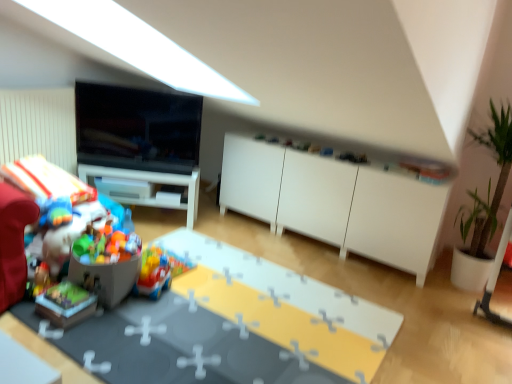
Measure the distance between white glossy desk at center and camera.

3.30 meters.

What are the coordinates of `translucent plastic toy car at center, which is the 1th toy from right to left` in the screenshot? It's located at (153, 273).

Find the location of a particular element. Image resolution: width=512 pixels, height=384 pixels. wooden block at lower left, arranged as the 2th toy when viewed from the left is located at coordinates (65, 304).

The height and width of the screenshot is (384, 512). What do you see at coordinates (65, 304) in the screenshot?
I see `wooden block at lower left, the 3th toy positioned from the right` at bounding box center [65, 304].

Locate an element on the screen. The width and height of the screenshot is (512, 384). matte plastic table at lower left is located at coordinates (286, 306).

What do you see at coordinates (335, 202) in the screenshot? The width and height of the screenshot is (512, 384). I see `white matte cabinet at center` at bounding box center [335, 202].

Where is `white matte cabinet at center`? Image resolution: width=512 pixels, height=384 pixels. white matte cabinet at center is located at coordinates (335, 202).

What do you see at coordinates (106, 275) in the screenshot?
I see `plastic colorful toys at lower left, marked as the second toy in a right-to-left arrangement` at bounding box center [106, 275].

You are a GUI agent. You are given a task and a screenshot of the screen. Output one action in this format:
    pyautogui.click(x=<x>, y=<y>)
    Task: Click on the white glossy desk at center
    The width and height of the screenshot is (512, 384).
    Given the screenshot: What is the action you would take?
    pyautogui.click(x=152, y=182)

Considering the positions of point (80, 187) and point (51, 295), is point (80, 187) closer or farther from the camera than point (51, 295)?

Point (80, 187).

Does multicolored plastic toys at left, which is the 4th toy from right to left, have a larger size compared to wooden block at lower left, the 3th toy positioned from the right?

Yes.

From the image's perspective, which is above, multicolored plastic toys at left, which is the 4th toy from right to left, or wooden block at lower left, arranged as the 2th toy when viewed from the left?

From the image's view, multicolored plastic toys at left, which is the 4th toy from right to left, is above.

Starting from the multicolored plastic toys at left, the 1th toy from the left, which toy is the 2nd one in front? Please provide its 2D coordinates.

[(65, 304)]

Between wooden block at lower left, the 3th toy positioned from the right, and multicolored plastic toys at left, which is the 4th toy from right to left, which one has less height?

Standing shorter between the two is wooden block at lower left, the 3th toy positioned from the right.

Is wooden block at lower left, the 3th toy positioned from the right, positioned far away from multicolored plastic toys at left, which is the 4th toy from right to left?

Actually, wooden block at lower left, the 3th toy positioned from the right, and multicolored plastic toys at left, which is the 4th toy from right to left, are a little close together.

Is wooden block at lower left, the 3th toy positioned from the right, not inside multicolored plastic toys at left, the 1th toy from the left?

Yes, wooden block at lower left, the 3th toy positioned from the right, is located beyond the bounds of multicolored plastic toys at left, the 1th toy from the left.

How many degrees apart are the facing directions of wooden block at lower left, arranged as the 2th toy when viewed from the left, and green leafy plant in pot at right?

The facing directions of wooden block at lower left, arranged as the 2th toy when viewed from the left, and green leafy plant in pot at right are 89.9 degrees apart.

Is wooden block at lower left, the 3th toy positioned from the right, bigger than green leafy plant in pot at right?

Incorrect, wooden block at lower left, the 3th toy positioned from the right, is not larger than green leafy plant in pot at right.

From the image's perspective, would you say wooden block at lower left, the 3th toy positioned from the right, is shown under green leafy plant in pot at right?

Correct, wooden block at lower left, the 3th toy positioned from the right, appears lower than green leafy plant in pot at right in the image.

Identify the location of toy that is the 2nd one when counting forward from the green leafy plant in pot at right. (65, 304).

Which of these two, multicolored plastic toys at left, the 1th toy from the left, or matte black tv at upper left, is thinner?

matte black tv at upper left.

Identify the location of television on the right of multicolored plastic toys at left, which is the 4th toy from right to left. The height and width of the screenshot is (384, 512). (137, 128).

Is multicolored plastic toys at left, which is the 4th toy from right to left, aimed at matte black tv at upper left?

No, multicolored plastic toys at left, which is the 4th toy from right to left, is not oriented towards matte black tv at upper left.

The height and width of the screenshot is (384, 512). I want to click on desk located behind the plastic colorful toys at lower left, marked as the second toy in a right-to-left arrangement, so click(x=152, y=182).

From the image's perspective, is plastic colorful toys at lower left, marked as the third toy in a left-to-right arrangement, above or below white glossy desk at center?

plastic colorful toys at lower left, marked as the third toy in a left-to-right arrangement, is below white glossy desk at center.

How many degrees apart are the facing directions of plastic colorful toys at lower left, marked as the third toy in a left-to-right arrangement, and wooden block at lower left, the 3th toy positioned from the right?

The facing directions of plastic colorful toys at lower left, marked as the third toy in a left-to-right arrangement, and wooden block at lower left, the 3th toy positioned from the right, are 19.9 degrees apart.

Considering the relative positions of plastic colorful toys at lower left, marked as the third toy in a left-to-right arrangement, and wooden block at lower left, arranged as the 2th toy when viewed from the left, in the image provided, is plastic colorful toys at lower left, marked as the third toy in a left-to-right arrangement, to the left of wooden block at lower left, arranged as the 2th toy when viewed from the left, from the viewer's perspective?

No.

Where is `toy that is the 1st object located behind the wooden block at lower left, the 3th toy positioned from the right`? This screenshot has width=512, height=384. toy that is the 1st object located behind the wooden block at lower left, the 3th toy positioned from the right is located at coordinates (106, 275).

Looking at this image, which of these two, plastic colorful toys at lower left, marked as the second toy in a right-to-left arrangement, or wooden block at lower left, the 3th toy positioned from the right, stands taller?

plastic colorful toys at lower left, marked as the second toy in a right-to-left arrangement.

From the picture: Would you say matte black tv at upper left is part of green leafy plant in pot at right's contents?

No, matte black tv at upper left is not a part of green leafy plant in pot at right.

Does green leafy plant in pot at right have a smaller size compared to matte black tv at upper left?

No, green leafy plant in pot at right is not smaller than matte black tv at upper left.

From the image's perspective, between green leafy plant in pot at right and matte black tv at upper left, which one is located above?

From the image's view, matte black tv at upper left is above.

Identify the location of the 3rd toy below the multicolored plastic toys at left, the 1th toy from the left (from the image's perspective). The height and width of the screenshot is (384, 512). (65, 304).

From the image's perspective, count 3rd toys upward from the wooden block at lower left, the 3th toy positioned from the right, and point to it. Please provide its 2D coordinates.

[(56, 205)]

Estimate the real-world distances between objects in this image. Which object is further from matte black tv at upper left, translucent plastic toy car at center, which is the 1th toy from right to left, or white glossy desk at center?

Based on the image, translucent plastic toy car at center, which is the 1th toy from right to left, appears to be further to matte black tv at upper left.

Which object lies nearer to the anchor point wooden block at lower left, the 3th toy positioned from the right, white matte cabinet at center or plastic colorful toys at lower left, marked as the third toy in a left-to-right arrangement?

plastic colorful toys at lower left, marked as the third toy in a left-to-right arrangement, is positioned closer to the anchor wooden block at lower left, the 3th toy positioned from the right.

Looking at the image, which one is located closer to translucent plastic toy car at center, marked as the 4th toy in a left-to-right arrangement, plastic colorful toys at lower left, marked as the second toy in a right-to-left arrangement, or multicolored plastic toys at left, which is the 4th toy from right to left?

Based on the image, plastic colorful toys at lower left, marked as the second toy in a right-to-left arrangement, appears to be nearer to translucent plastic toy car at center, marked as the 4th toy in a left-to-right arrangement.

Considering their positions, is multicolored plastic toys at left, the 1th toy from the left, positioned closer to white matte cabinet at center than green leafy plant in pot at right?

green leafy plant in pot at right is closer to white matte cabinet at center.

Considering their positions, is white matte cabinet at center positioned closer to plastic colorful toys at lower left, marked as the second toy in a right-to-left arrangement, than wooden block at lower left, the 3th toy positioned from the right?

Among the two, wooden block at lower left, the 3th toy positioned from the right, is located nearer to plastic colorful toys at lower left, marked as the second toy in a right-to-left arrangement.

From the image, which object appears to be nearer to plastic colorful toys at lower left, marked as the third toy in a left-to-right arrangement, white glossy desk at center or wooden block at lower left, the 3th toy positioned from the right?

wooden block at lower left, the 3th toy positioned from the right, lies closer to plastic colorful toys at lower left, marked as the third toy in a left-to-right arrangement, than the other object.

When comparing their distances from white matte cabinet at center, does white glossy desk at center or wooden block at lower left, the 3th toy positioned from the right, seem closer?

white glossy desk at center is positioned closer to the anchor white matte cabinet at center.

Which object lies further to the anchor point wooden block at lower left, the 3th toy positioned from the right, matte plastic table at lower left or matte black tv at upper left?

matte black tv at upper left is positioned further to the anchor wooden block at lower left, the 3th toy positioned from the right.

Find the location of a particular element. The width and height of the screenshot is (512, 384). desk between matte black tv at upper left and translucent plastic toy car at center, marked as the 4th toy in a left-to-right arrangement, in the vertical direction is located at coordinates (152, 182).

Locate an element on the screen. The height and width of the screenshot is (384, 512). cabinetry located between translucent plastic toy car at center, marked as the 4th toy in a left-to-right arrangement, and green leafy plant in pot at right in the left-right direction is located at coordinates (335, 202).

I want to click on table between wooden block at lower left, the 3th toy positioned from the right, and green leafy plant in pot at right from left to right, so click(286, 306).

Locate an element on the screen. Image resolution: width=512 pixels, height=384 pixels. toy between plastic colorful toys at lower left, marked as the second toy in a right-to-left arrangement, and green leafy plant in pot at right is located at coordinates (153, 273).